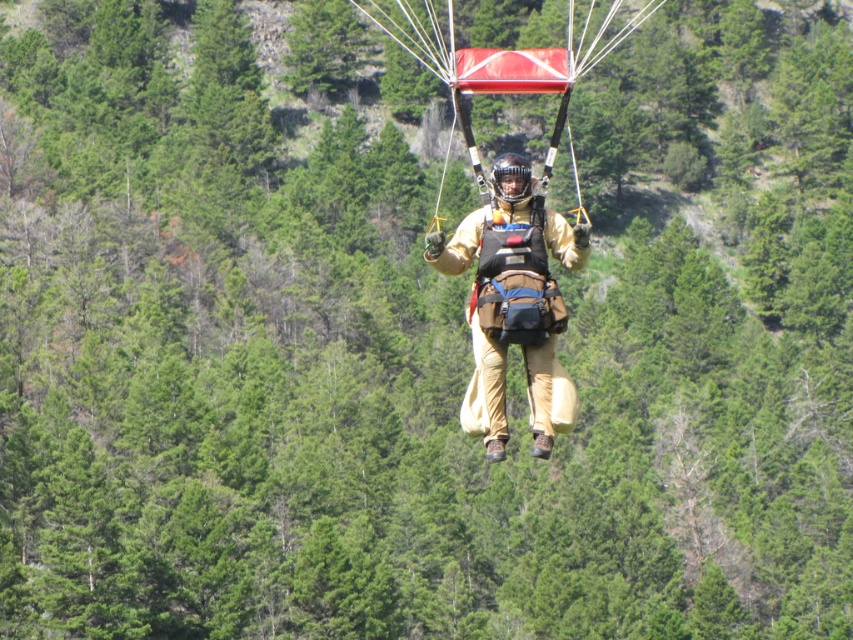
Is tan fabric parachute at center further to the viewer compared to red fabric parachute at center?

That is False.

Is point (514, 180) more distant than point (572, 76)?

No, it is in front of (572, 76).

Locate an element on the screen. This screenshot has width=853, height=640. tan fabric parachute at center is located at coordinates 512,301.